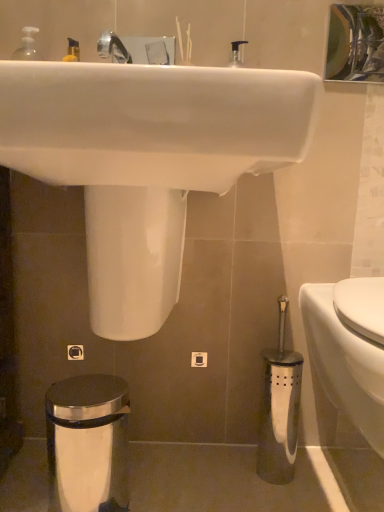
The image size is (384, 512). Find the location of `vacant area on top of satin chrome trash can at lower left (from a real-world perspective)`. vacant area on top of satin chrome trash can at lower left (from a real-world perspective) is located at coordinates (87, 391).